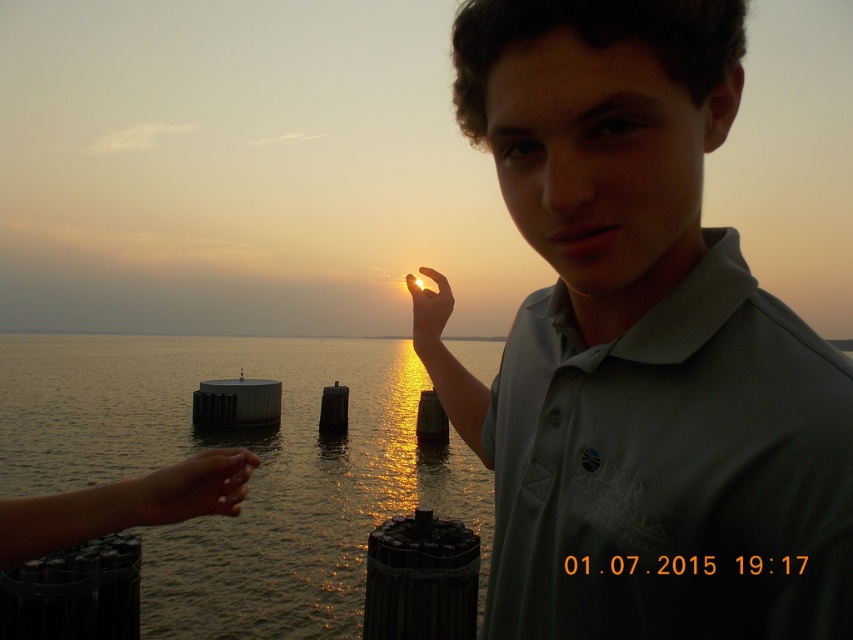
Question: Does matte green polo shirt at center appear on the right side of glistening water at center?

Choices:
 (A) no
 (B) yes

Answer: (B)

Question: Considering the real-world distances, which object is closest to the translucent golden hand at center?

Choices:
 (A) matte green polo shirt at center
 (B) glistening water at center
 (C) smooth skin hand at lower left

Answer: (A)

Question: Which of the following is the farthest from the observer?

Choices:
 (A) glistening water at center
 (B) smooth skin hand at lower left
 (C) translucent golden hand at center

Answer: (C)

Question: Is glistening water at center positioned in front of smooth skin hand at lower left?

Choices:
 (A) no
 (B) yes

Answer: (A)

Question: Is glistening water at center thinner than smooth skin hand at lower left?

Choices:
 (A) yes
 (B) no

Answer: (B)

Question: Estimate the real-world distances between objects in this image. Which object is closer to the smooth skin hand at lower left?

Choices:
 (A) matte green polo shirt at center
 (B) glistening water at center
 (C) translucent golden hand at center

Answer: (A)